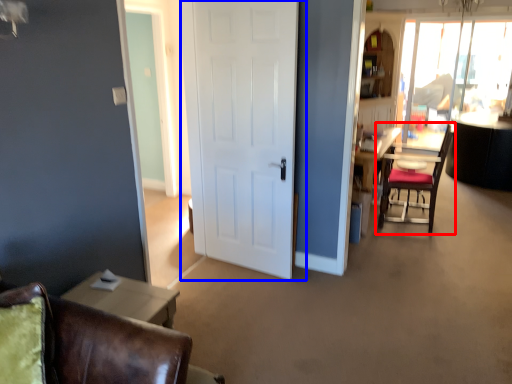
Question: Which point is further to the camera, chair (highlighted by a red box) or door (highlighted by a blue box)?

Choices:
 (A) chair
 (B) door

Answer: (A)